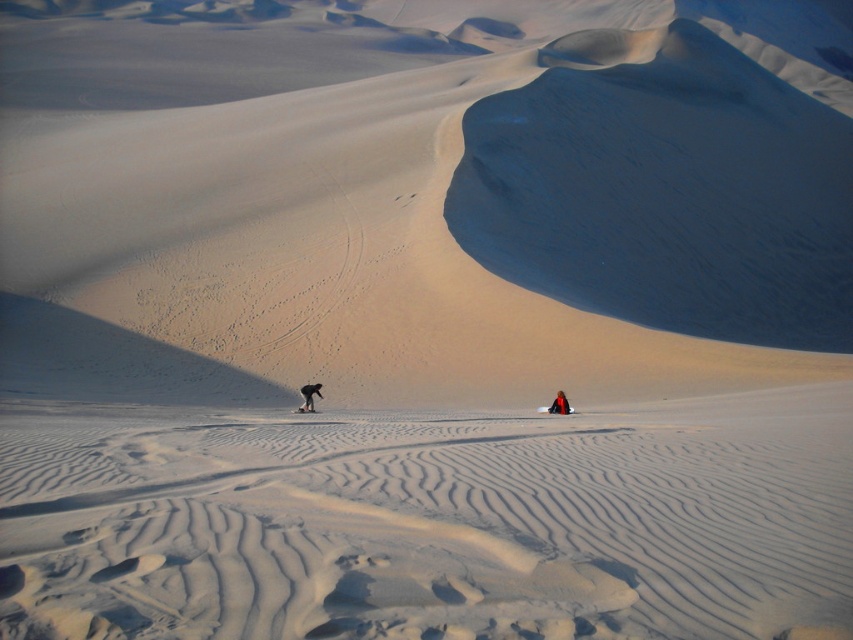
Question: Can you confirm if smooth sand dune at center is positioned above dark brown sandboarder at lower center?

Choices:
 (A) yes
 (B) no

Answer: (A)

Question: Is orange fabric person at lower right to the left of matte black ski at center from the viewer's perspective?

Choices:
 (A) no
 (B) yes

Answer: (A)

Question: Which object is positioned closest to the smooth sand dune at center?

Choices:
 (A) matte black ski at center
 (B) orange fabric person at lower right

Answer: (B)

Question: Which of these objects is positioned farthest from the smooth sand dune at center?

Choices:
 (A) dark brown sandboarder at lower center
 (B) orange fabric person at lower right
 (C) matte black ski at center

Answer: (A)

Question: Among these objects, which one is nearest to the camera?

Choices:
 (A) orange fabric person at lower right
 (B) dark brown sandboarder at lower center
 (C) matte black ski at center
 (D) smooth sand dune at center

Answer: (A)

Question: In this image, where is orange fabric person at lower right located relative to matte black ski at center?

Choices:
 (A) above
 (B) below

Answer: (A)